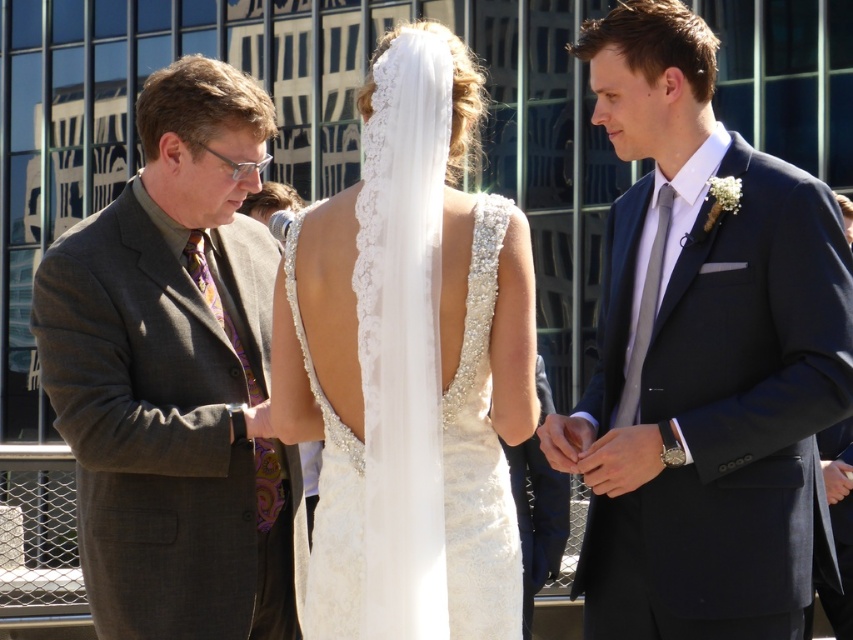
From the picture: Who is positioned more to the right, navy blue suit at center or white lace veil at center?

From the viewer's perspective, navy blue suit at center appears more on the right side.

In the scene shown: Is navy blue suit at center taller than white lace veil at center?

Incorrect, navy blue suit at center's height is not larger of white lace veil at center's.

Between point (767, 564) and point (374, 257), which one is positioned in front?

Point (374, 257) is more forward.

This screenshot has width=853, height=640. Find the location of `navy blue suit at center`. navy blue suit at center is located at coordinates coord(703,356).

In the scene shown: Measure the distance between ivory lace dress at center and camera.

ivory lace dress at center is 45.96 feet away from camera.

The width and height of the screenshot is (853, 640). Describe the element at coordinates (410, 365) in the screenshot. I see `ivory lace dress at center` at that location.

Between point (531, 288) and point (369, 412), which one is positioned behind?

Positioned behind is point (531, 288).

Find the location of a particular element. The image size is (853, 640). ivory lace dress at center is located at coordinates (410, 365).

This screenshot has height=640, width=853. Describe the element at coordinates (703, 356) in the screenshot. I see `navy blue suit at center` at that location.

Does navy blue suit at center appear on the left side of ivory lace dress at center?

Incorrect, navy blue suit at center is not on the left side of ivory lace dress at center.

This screenshot has width=853, height=640. I want to click on navy blue suit at center, so click(x=703, y=356).